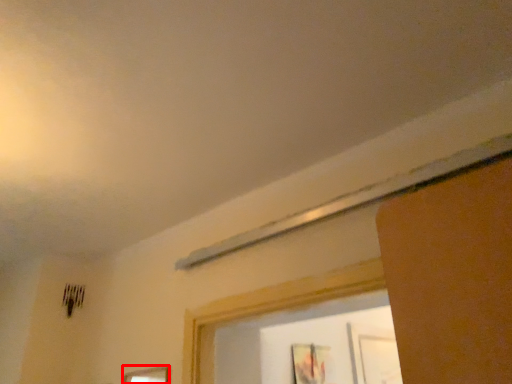
Question: Where is picture frame (annotated by the red box) located in relation to picture frame in the image?

Choices:
 (A) right
 (B) left

Answer: (B)